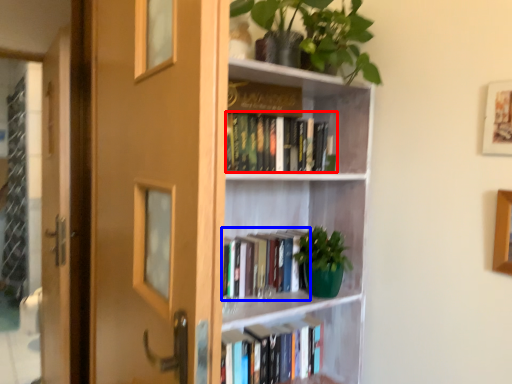
Question: Which of the following is the farthest to the observer, book (highlighted by a red box) or book (highlighted by a blue box)?

Choices:
 (A) book
 (B) book

Answer: (B)